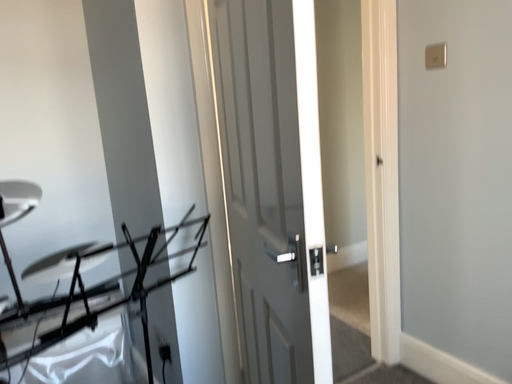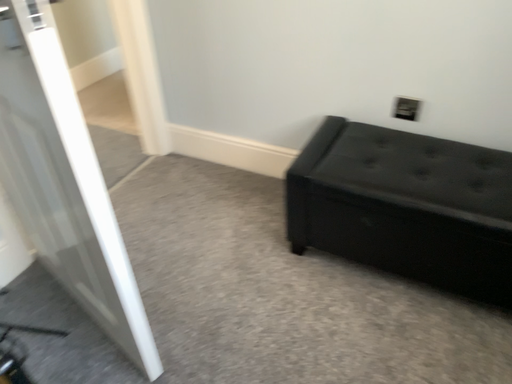
Question: How did the camera likely rotate when shooting the video?

Choices:
 (A) rotated upward
 (B) rotated downward

Answer: (B)